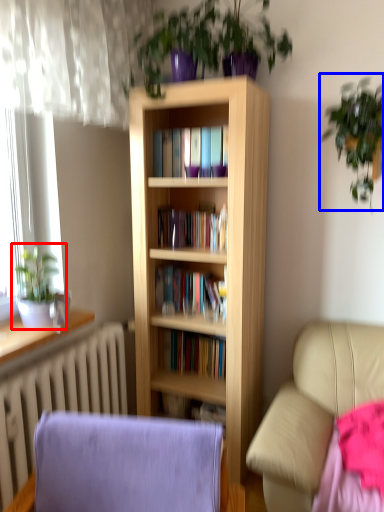
Question: Which object appears closest to the camera in this image, houseplant (highlighted by a red box) or houseplant (highlighted by a blue box)?

Choices:
 (A) houseplant
 (B) houseplant

Answer: (B)